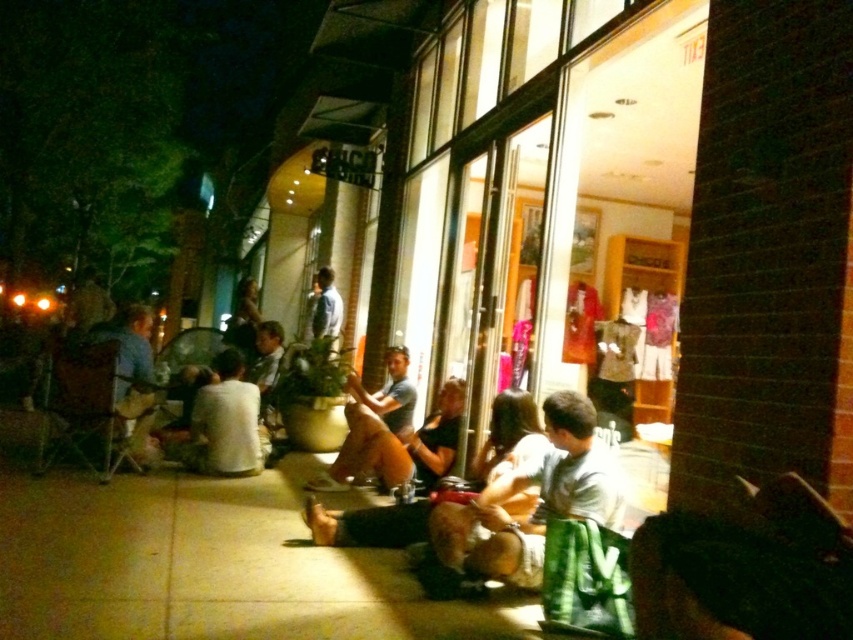
You are a photographer standing in front of the store at night. You notice two items of clothing in the scene. The first is a green fabric skirt at center, and the second is a light blue shirt at center. Which clothing item is positioned lower relative to the other?

The green fabric skirt at center is below the light blue shirt at center, so the green fabric skirt at center is positioned lower.

You are a delivery person trying to place a small package on the ground near the smooth concrete pavement at center and the green fabric skirt at center. Which object should you place the package on to ensure it stays elevated?

The green fabric skirt at center is taller than the smooth concrete pavement at center, so placing the package on the green fabric skirt at center will keep it elevated.